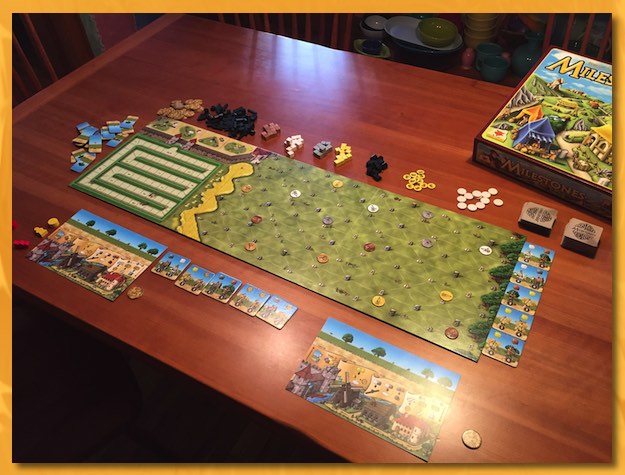
Locate an element on the screen. blue bowl is located at coordinates (497, 65), (488, 50), (527, 56).